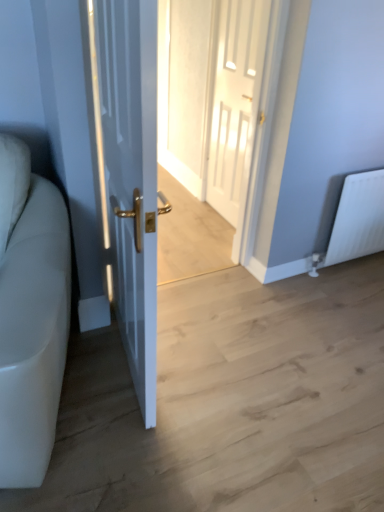
Measure the distance between point (x=122, y=208) and camera.

1.27 meters.

Where is `white glossy door at left, the first door positioned from the front`? This screenshot has height=512, width=384. white glossy door at left, the first door positioned from the front is located at coordinates (132, 177).

You are a GUI agent. You are given a task and a screenshot of the screen. Output one action in this format:
    pyautogui.click(x=<x>, y=<y>)
    Task: Click on the white glossy door at center
    This screenshot has width=384, height=512.
    Given the screenshot: What is the action you would take?
    pyautogui.click(x=220, y=102)

Describe the element at coordinates (30, 315) in the screenshot. The image size is (384, 512). I see `white leather couch at left` at that location.

Describe the element at coordinates (356, 221) in the screenshot. I see `white matte radiator at right` at that location.

The width and height of the screenshot is (384, 512). Identify the location of white glossy door at center, arranged as the second door when viewed from the left. (233, 102).

The height and width of the screenshot is (512, 384). In order to click on white glossy door at left, the 2th door in the back-to-front sequence in this screenshot , I will do `click(132, 177)`.

Which object is positioned more to the right, white leather couch at left or white glossy door at left, the first door positioned from the front?

white glossy door at left, the first door positioned from the front, is more to the right.

From their relative heights in the image, would you say white leather couch at left is taller or shorter than white glossy door at left, the first door positioned from the front?

Considering their sizes, white leather couch at left has less height than white glossy door at left, the first door positioned from the front.

Which is behind, point (56, 358) or point (131, 372)?

The point (131, 372) is farther from the camera.

Looking at the image, does white leather couch at left seem bigger or smaller compared to white glossy door at left, the 2th door in the back-to-front sequence?

white leather couch at left is bigger than white glossy door at left, the 2th door in the back-to-front sequence.

Could you measure the distance between white glossy door at left, the first door positioned from the front, and white glossy door at center?

The distance of white glossy door at left, the first door positioned from the front, from white glossy door at center is 1.30 meters.

You are a GUI agent. You are given a task and a screenshot of the screen. Output one action in this format:
    pyautogui.click(x=<x>, y=<y>)
    Task: Click on the door in front of the white glossy door at center
    
    Given the screenshot: What is the action you would take?
    pyautogui.click(x=132, y=177)

In the image, is white glossy door at left, which is the second door from right to left, positioned in front of or behind white glossy door at center?

Visually, white glossy door at left, which is the second door from right to left, is located in front of white glossy door at center.

From the picture: Can you confirm if white glossy door at left, the first door positioned from the front, is positioned to the left of white glossy door at center?

Indeed, white glossy door at left, the first door positioned from the front, is positioned on the left side of white glossy door at center.

Does white glossy door at center lie behind white glossy door at center, the 2th door when ordered from front to back?

No.

From a real-world perspective, which object stands above the other?

white glossy door at center, from a real-world perspective.

Considering the positions of objects white glossy door at center and white glossy door at center, the 2th door when ordered from front to back, in the image provided, who is more to the left, white glossy door at center or white glossy door at center, the 2th door when ordered from front to back,?

Positioned to the left is white glossy door at center.

From the image's perspective, relative to white glossy door at center, arranged as the second door when viewed from the left, is white glossy door at center above or below?

Clearly, from the image's perspective, white glossy door at center is below white glossy door at center, arranged as the second door when viewed from the left.

Can you tell me how much white glossy door at center, the first door viewed from the right, and white glossy door at center differ in facing direction?

86.9 degrees.

Is white glossy door at center at the back of white glossy door at center, arranged as the second door when viewed from the left?

No, white glossy door at center, arranged as the second door when viewed from the left,'s orientation is not away from white glossy door at center.

Considering the relative positions of white glossy door at center, the first door viewed from the right, and white glossy door at center in the image provided, is white glossy door at center, the first door viewed from the right, to the left of white glossy door at center from the viewer's perspective?

No.

Who is bigger, white glossy door at center, arranged as the second door when viewed from the left, or white glossy door at center?

With larger size is white glossy door at center.

Which object is thinner, white leather couch at left or white glossy door at center, the 2th door when ordered from front to back?

white glossy door at center, the 2th door when ordered from front to back.

Which door is the 2nd one when counting from the right side of the white leather couch at left? Please provide its 2D coordinates.

[(233, 102)]

From a real-world perspective, which is physically below, white leather couch at left or white glossy door at center, arranged as the second door when viewed from the left?

white leather couch at left, from a real-world perspective.

In the image, is white leather couch at left on the left side or the right side of white glossy door at center, the 2th door when ordered from front to back?

Clearly, white leather couch at left is on the left of white glossy door at center, the 2th door when ordered from front to back, in the image.

Does white matte radiator at right turn towards white glossy door at left, the 2th door in the back-to-front sequence?

No, white matte radiator at right does not turn towards white glossy door at left, the 2th door in the back-to-front sequence.

The width and height of the screenshot is (384, 512). In order to click on radiator behind the white glossy door at left, which is the second door from right to left in this screenshot , I will do `click(356, 221)`.

Is white matte radiator at right bigger or smaller than white glossy door at left, positioned as the first door in left-to-right order?

white matte radiator at right is smaller than white glossy door at left, positioned as the first door in left-to-right order.

Can white glossy door at left, which is the second door from right to left, be found inside white matte radiator at right?

That's incorrect, white glossy door at left, which is the second door from right to left, is not inside white matte radiator at right.

From the image's perspective, is white leather couch at left under white matte radiator at right?

Yes.

In the scene shown: Is white leather couch at left to the left of white matte radiator at right from the viewer's perspective?

Correct, you'll find white leather couch at left to the left of white matte radiator at right.

Is white leather couch at left spatially inside white matte radiator at right, or outside of it?

white leather couch at left is spatially situated outside white matte radiator at right.

Where is `couch lying in front of the white matte radiator at right`? Image resolution: width=384 pixels, height=512 pixels. couch lying in front of the white matte radiator at right is located at coordinates (30, 315).

At what (x,y) coordinates should I click in order to perform the action: click on couch that appears on the left of white glossy door at left, the 2th door in the back-to-front sequence. Please return your answer as a coordinate pair (x, y). The width and height of the screenshot is (384, 512). Looking at the image, I should click on (30, 315).

At what (x,y) coordinates should I click in order to perform the action: click on glass door behind the white glossy door at left, which is the second door from right to left. Please return your answer as a coordinate pair (x, y). Looking at the image, I should click on (220, 102).

In the scene shown: When comparing their distances from white glossy door at left, the 2th door in the back-to-front sequence, does white glossy door at center, which is the first door in back-to-front order, or white matte radiator at right seem closer?

white glossy door at center, which is the first door in back-to-front order.

Estimate the real-world distances between objects in this image. Which object is further from white leather couch at left, white matte radiator at right or white glossy door at left, the first door positioned from the front?

white matte radiator at right lies further to white leather couch at left than the other object.

Which object lies further to the anchor point white glossy door at center, the first door viewed from the right, white glossy door at center or white glossy door at left, the first door positioned from the front?

white glossy door at left, the first door positioned from the front, lies further to white glossy door at center, the first door viewed from the right, than the other object.

Considering their positions, is white glossy door at left, positioned as the first door in left-to-right order, positioned further to white glossy door at center, arranged as the second door when viewed from the left, than white leather couch at left?

Based on the image, white leather couch at left appears to be further to white glossy door at center, arranged as the second door when viewed from the left.

Estimate the real-world distances between objects in this image. Which object is closer to white leather couch at left, white glossy door at center, the 2th door when ordered from front to back, or white glossy door at center?

white glossy door at center, the 2th door when ordered from front to back.

When comparing their distances from white matte radiator at right, does white glossy door at left, positioned as the first door in left-to-right order, or white glossy door at center seem further?

white glossy door at left, positioned as the first door in left-to-right order, is further to white matte radiator at right.

When comparing their distances from white glossy door at center, the first door viewed from the right, does white leather couch at left or white glossy door at left, the first door positioned from the front, seem further?

Among the two, white leather couch at left is located further to white glossy door at center, the first door viewed from the right.

Estimate the real-world distances between objects in this image. Which object is closer to white glossy door at center, white matte radiator at right or white glossy door at left, the 2th door in the back-to-front sequence?

white matte radiator at right is positioned closer to the anchor white glossy door at center.

Where is `door between white leather couch at left and white glossy door at center, arranged as the second door when viewed from the left, from front to back`? The image size is (384, 512). door between white leather couch at left and white glossy door at center, arranged as the second door when viewed from the left, from front to back is located at coordinates (132, 177).

This screenshot has height=512, width=384. I want to click on door between white leather couch at left and white glossy door at center from front to back, so click(132, 177).

You are a GUI agent. You are given a task and a screenshot of the screen. Output one action in this format:
    pyautogui.click(x=<x>, y=<y>)
    Task: Click on the glass door between white leather couch at left and white glossy door at center, the first door viewed from the right, in the front-back direction
    The width and height of the screenshot is (384, 512).
    Given the screenshot: What is the action you would take?
    pyautogui.click(x=220, y=102)

Identify the location of glass door positioned between white glossy door at left, the first door positioned from the front, and white glossy door at center, the 2th door when ordered from front to back, from near to far. The height and width of the screenshot is (512, 384). (220, 102).